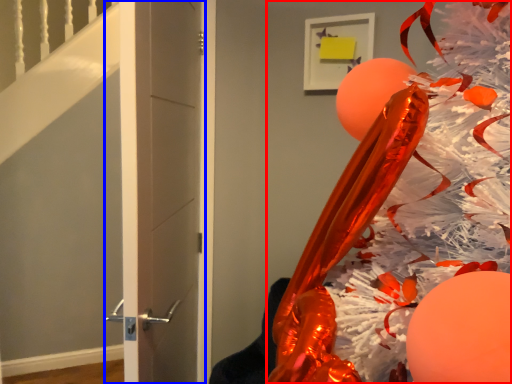
Question: Which object appears farthest to the camera in this image, christmas tree (highlighted by a red box) or door (highlighted by a blue box)?

Choices:
 (A) christmas tree
 (B) door

Answer: (B)